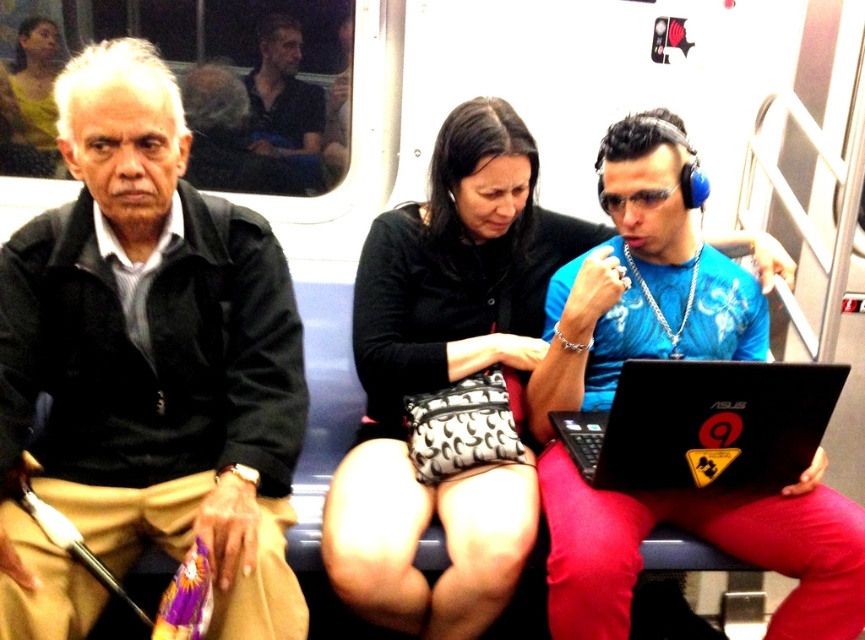
Does point (225, 481) come behind point (280, 17)?

No.

Is point (84, 76) positioned after point (271, 116)?

No, (84, 76) is in front of (271, 116).

Where is `matte black jacket at left`? This screenshot has height=640, width=865. matte black jacket at left is located at coordinates (157, 349).

Does matte black jacket at left have a larger size compared to black matte laptop at center?

Yes.

Where is `matte black jacket at left`? Image resolution: width=865 pixels, height=640 pixels. matte black jacket at left is located at coordinates (157, 349).

Locate an element on the screen. Image resolution: width=865 pixels, height=640 pixels. matte black jacket at left is located at coordinates (157, 349).

In the scene shown: Between black fabric purse at center and dark blue shirt at upper center, which one appears on the right side from the viewer's perspective?

Positioned to the right is black fabric purse at center.

Image resolution: width=865 pixels, height=640 pixels. I want to click on black fabric purse at center, so click(445, 376).